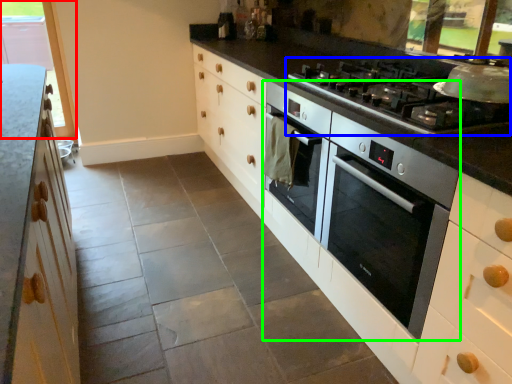
Question: Based on their relative distances, which object is farther from window (highlighted by a red box)? Choose from gas stove (highlighted by a blue box) and home appliance (highlighted by a green box).

Choices:
 (A) gas stove
 (B) home appliance

Answer: (B)